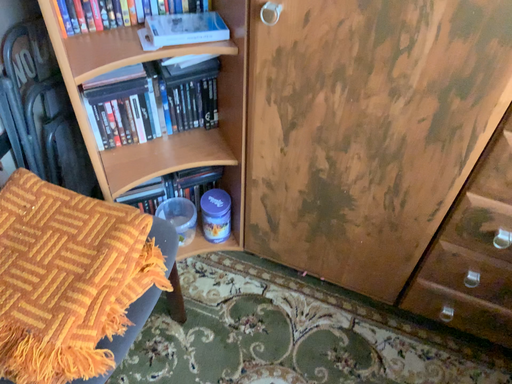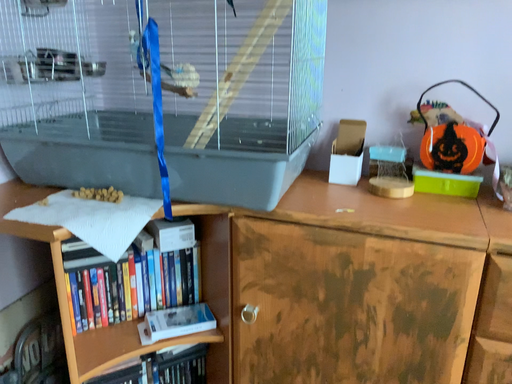
Question: How did the camera likely rotate when shooting the video?

Choices:
 (A) rotated downward
 (B) rotated upward

Answer: (B)